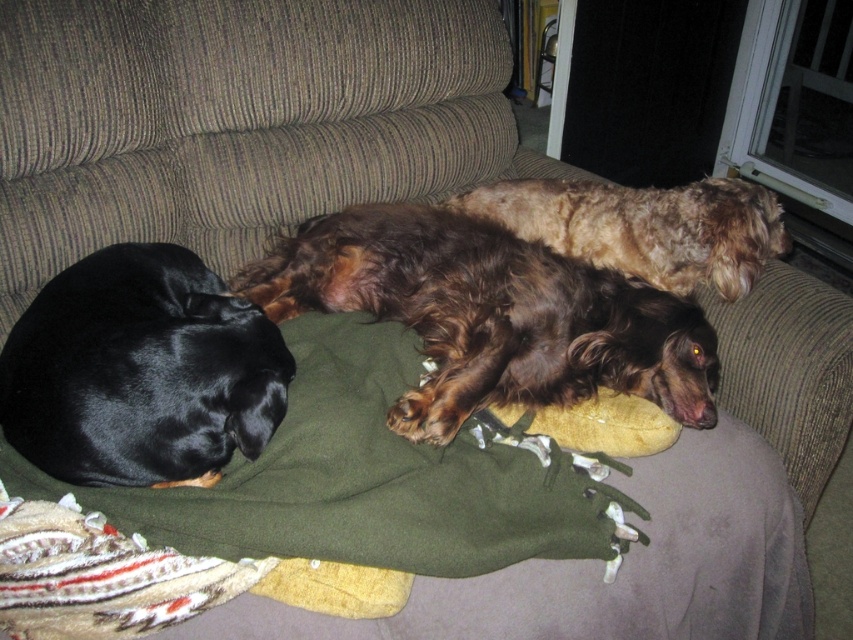
Which of these two, brown shaggy dog at center or black glossy dog at left, stands taller?

Standing taller between the two is brown shaggy dog at center.

Is brown shaggy dog at center to the left of black glossy dog at left from the viewer's perspective?

No, brown shaggy dog at center is not to the left of black glossy dog at left.

This screenshot has width=853, height=640. What are the coordinates of `brown shaggy dog at center` in the screenshot? It's located at (491, 314).

Between point (222, 412) and point (646, 227), which one is positioned behind?

The point (646, 227) is behind.

Who is more distant from viewer, (128, 342) or (706, 204)?

The point (706, 204) is behind.

Where is `black glossy dog at left`? The height and width of the screenshot is (640, 853). black glossy dog at left is located at coordinates (141, 371).

Between brown shaggy dog at center and fuzzy brown dog at center, which one has more height?

brown shaggy dog at center is taller.

Is point (581, 372) closer to viewer compared to point (694, 241)?

Yes, it is in front of point (694, 241).

You are a GUI agent. You are given a task and a screenshot of the screen. Output one action in this format:
    pyautogui.click(x=<x>, y=<y>)
    Task: Click on the brown shaggy dog at center
    
    Given the screenshot: What is the action you would take?
    pyautogui.click(x=491, y=314)